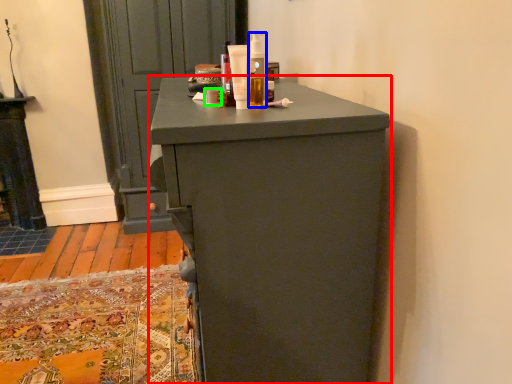
Question: Which object is positioned farthest from chest of drawers (highlighted by a red box)? Select from toiletry (highlighted by a blue box) and toiletry (highlighted by a green box).

Choices:
 (A) toiletry
 (B) toiletry

Answer: (B)